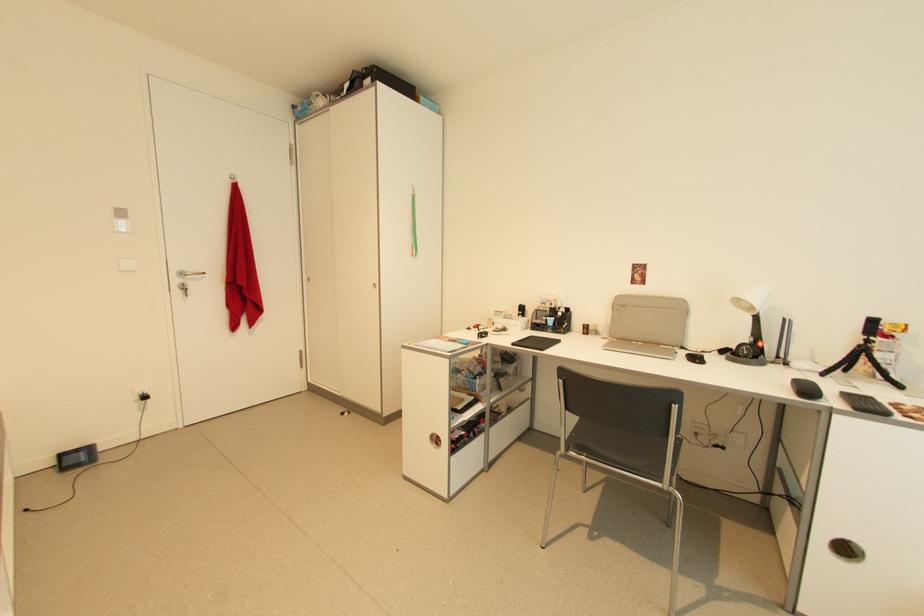
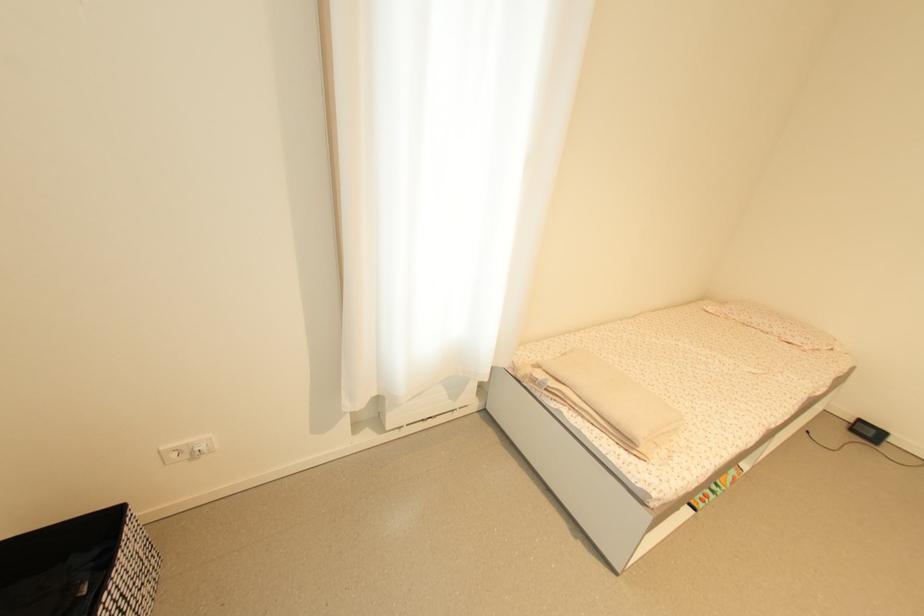
First-person continuous shooting, in which direction is the camera rotating?

The camera rotated toward left-down.